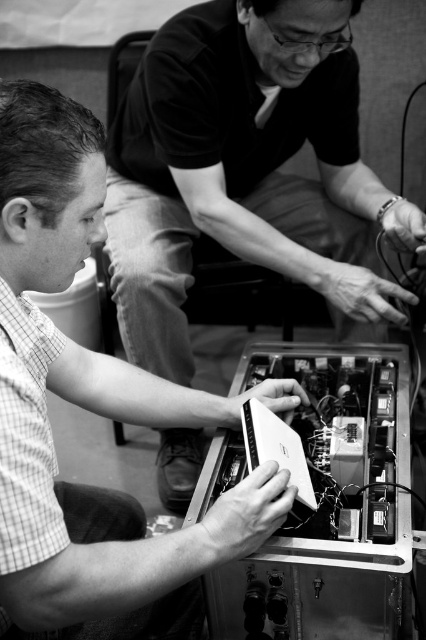
What do you see at coordinates (245, 170) in the screenshot? I see `metallic circuit board at center` at bounding box center [245, 170].

Who is more distant from viewer, (184, 97) or (32, 280)?

Point (184, 97)

Is point (330, 70) positioned before point (270, 381)?

No, (330, 70) is further to viewer.

The width and height of the screenshot is (426, 640). I want to click on metallic circuit board at center, so click(x=245, y=170).